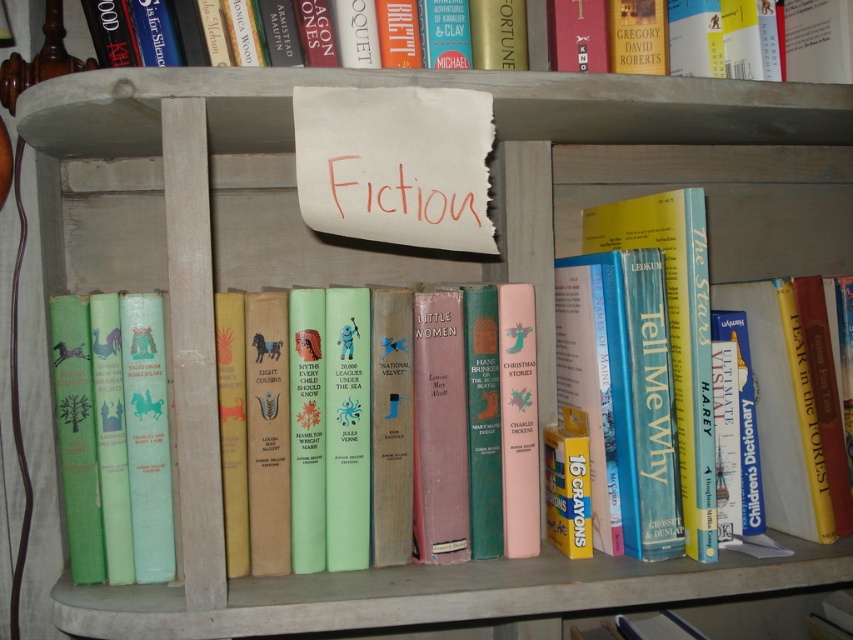
Question: Is blue hardcover book at center smaller than hardcover book at upper center?

Choices:
 (A) no
 (B) yes

Answer: (A)

Question: Which point is closer to the camera taking this photo?

Choices:
 (A) (641, 202)
 (B) (840, 65)

Answer: (B)

Question: Can you confirm if blue hardcover book at center is smaller than hardcover book at upper center?

Choices:
 (A) no
 (B) yes

Answer: (A)

Question: Among these objects, which one is nearest to the camera?

Choices:
 (A) hardcover book at upper center
 (B) blue hardcover book at center

Answer: (B)

Question: Can you confirm if blue hardcover book at center is wider than hardcover book at upper center?

Choices:
 (A) no
 (B) yes

Answer: (A)